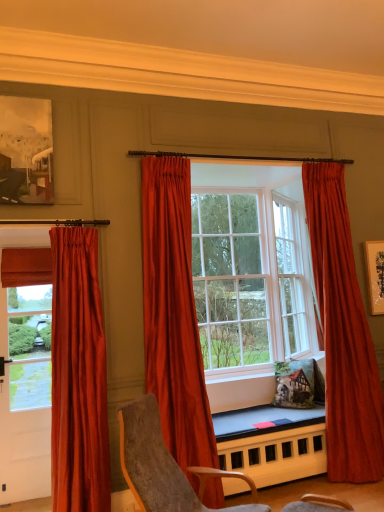
Question: Is velvet gray chair at center positioned with its back to satin red curtain at center, positioned as the third curtain in left-to-right order?

Choices:
 (A) yes
 (B) no

Answer: (B)

Question: Considering the relative positions of velvet gray chair at center and satin red curtain at center, positioned as the third curtain in left-to-right order, in the image provided, is velvet gray chair at center to the left of satin red curtain at center, positioned as the third curtain in left-to-right order, from the viewer's perspective?

Choices:
 (A) yes
 (B) no

Answer: (A)

Question: Considering the relative sizes of velvet gray chair at center and satin red curtain at center, which appears as the 1th curtain when viewed from the right, in the image provided, is velvet gray chair at center taller than satin red curtain at center, which appears as the 1th curtain when viewed from the right,?

Choices:
 (A) no
 (B) yes

Answer: (A)

Question: From a real-world perspective, is velvet gray chair at center positioned over satin red curtain at center, positioned as the third curtain in left-to-right order, based on gravity?

Choices:
 (A) no
 (B) yes

Answer: (A)

Question: From a real-world perspective, is velvet gray chair at center located beneath satin red curtain at center, positioned as the third curtain in left-to-right order?

Choices:
 (A) yes
 (B) no

Answer: (A)

Question: Is satin red curtain at center, which appears as the 1th curtain when viewed from the right, located within velvet gray chair at center?

Choices:
 (A) yes
 (B) no

Answer: (B)

Question: Is the depth of satin red curtains at center greater than that of satin orange curtain at center, placed as the 2th curtain when sorted from left to right?

Choices:
 (A) no
 (B) yes

Answer: (B)

Question: From a real-world perspective, is satin red curtains at center on satin orange curtain at center, which ranks as the 2th curtain in right-to-left order?

Choices:
 (A) no
 (B) yes

Answer: (B)

Question: Is satin red curtains at center aimed at satin orange curtain at center, which ranks as the 2th curtain in right-to-left order?

Choices:
 (A) no
 (B) yes

Answer: (A)

Question: Considering the relative positions of satin red curtains at center and satin orange curtain at center, which ranks as the 2th curtain in right-to-left order, in the image provided, is satin red curtains at center to the right of satin orange curtain at center, which ranks as the 2th curtain in right-to-left order, from the viewer's perspective?

Choices:
 (A) no
 (B) yes

Answer: (B)

Question: From the image's perspective, does satin red curtains at center appear higher than satin orange curtain at center, placed as the 2th curtain when sorted from left to right?

Choices:
 (A) yes
 (B) no

Answer: (A)

Question: Considering the relative sizes of satin red curtains at center and satin orange curtain at center, placed as the 2th curtain when sorted from left to right, in the image provided, is satin red curtains at center shorter than satin orange curtain at center, placed as the 2th curtain when sorted from left to right,?

Choices:
 (A) yes
 (B) no

Answer: (A)

Question: Is satin orange curtain at center, which ranks as the 2th curtain in right-to-left order, thinner than smooth wooden table at center?

Choices:
 (A) yes
 (B) no

Answer: (A)